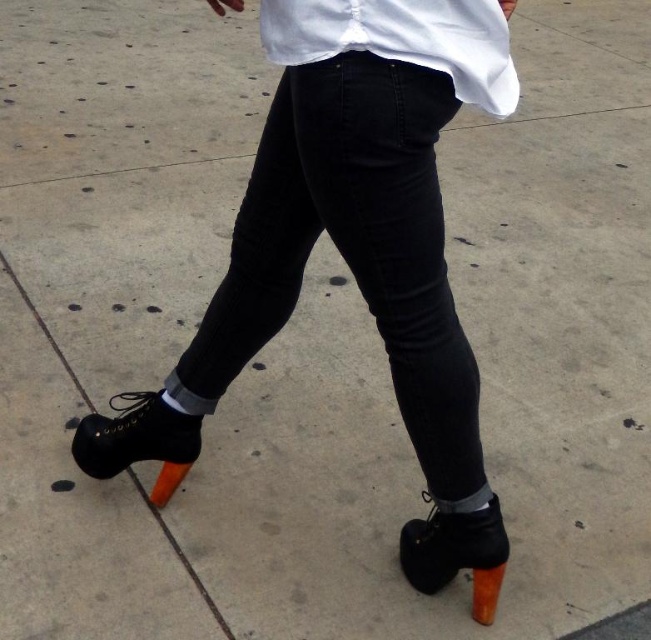
You are trying to decide whether to wear the black denim jeans at center with the orange matte heel at lower left for an event. Considering their heights, will the jeans cover the heel completely when worn?

The black denim jeans at center is much taller than the orange matte heel at lower left, so when worn, the jeans will cover the heel completely.

You are a fashion designer looking at an outfit. You see a white matte shirt at upper center and a black leather shoe at lower left. Which item is located higher up on the person?

The white matte shirt at upper center is positioned over the black leather shoe at lower left, meaning it is higher up on the person.

You are a fashion designer trying to create a new line of outfits. You want to ensure that the black denim jeans at center and the black leather shoe at lower left in the image will look balanced together. Based on their widths, do you think the jeans and shoe will complement each other in terms of proportions?

The black denim jeans at center might be wider than black leather shoe at lower left, so they could create a balanced look as the wider jeans provide a stable base for the narrower shoe.